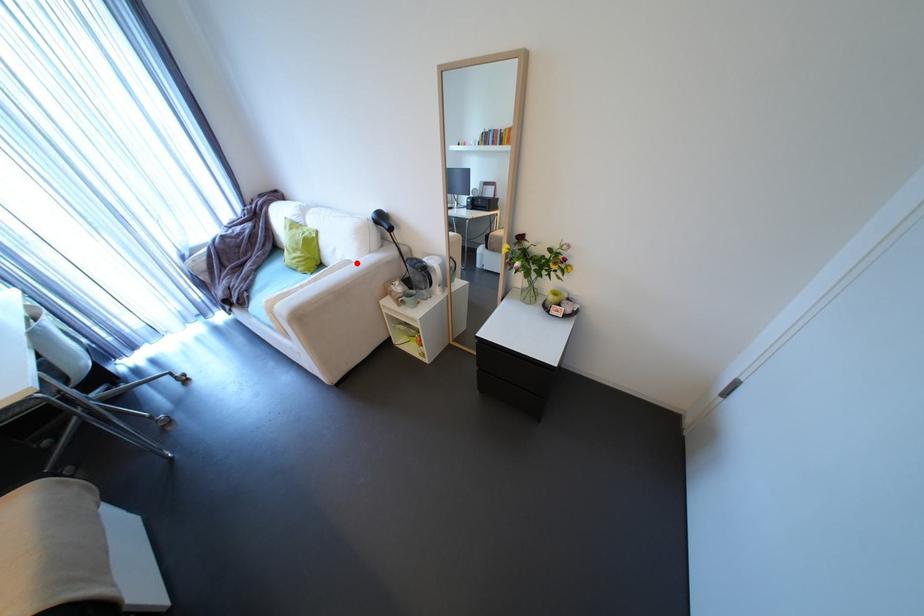
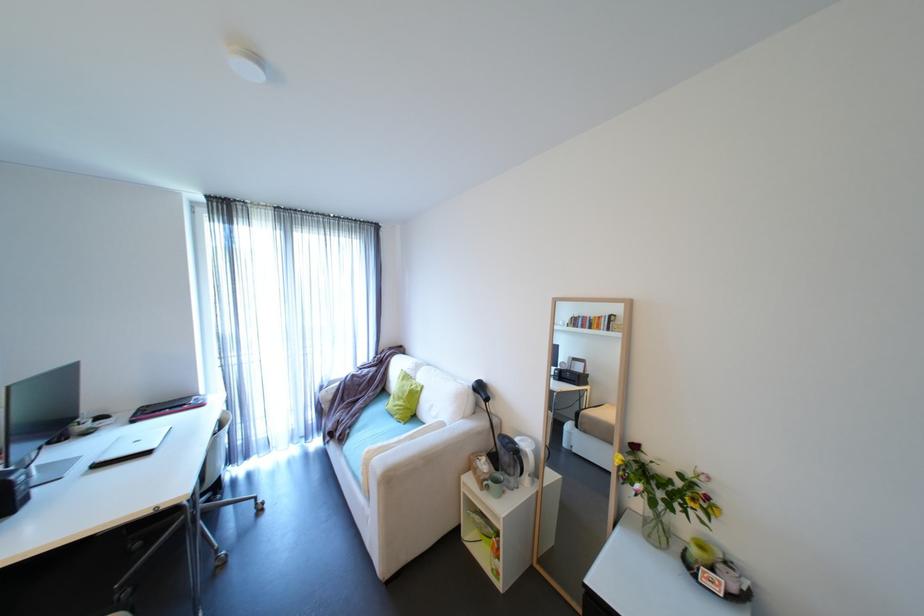
Where in the second image is the point corresponding to the highlighted location from the first image?

(450, 424)